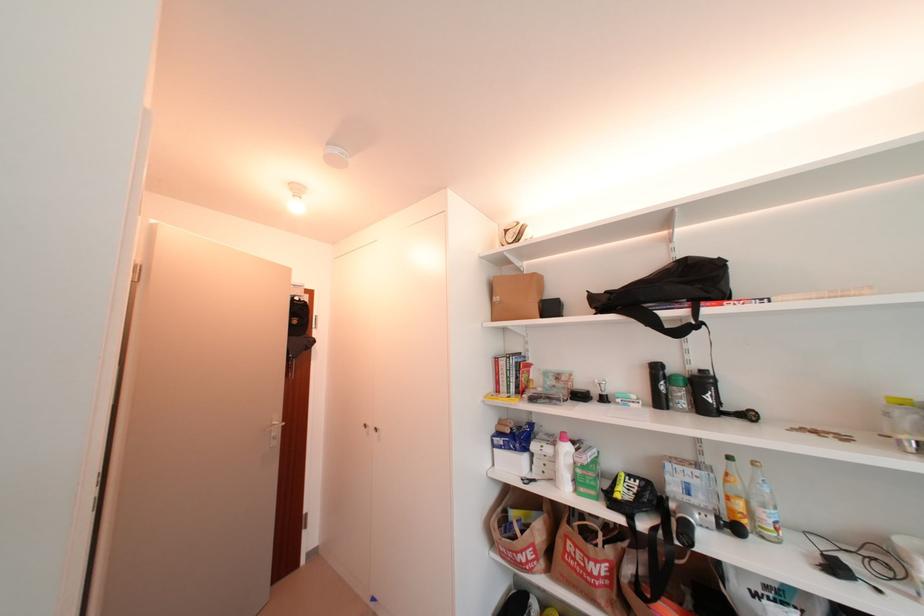
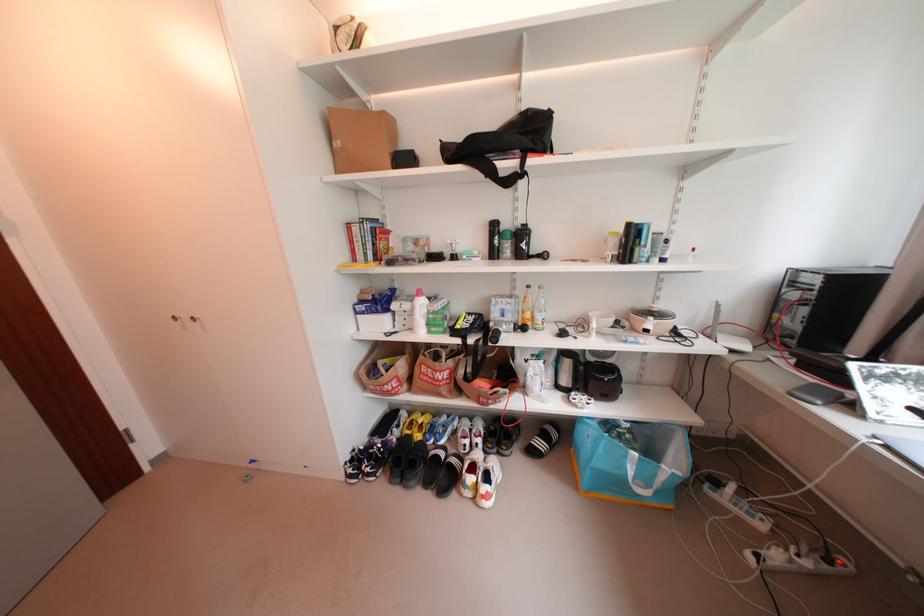
In the second image, find the point that corresponds to pixel 721 520 in the first image.

(520, 326)